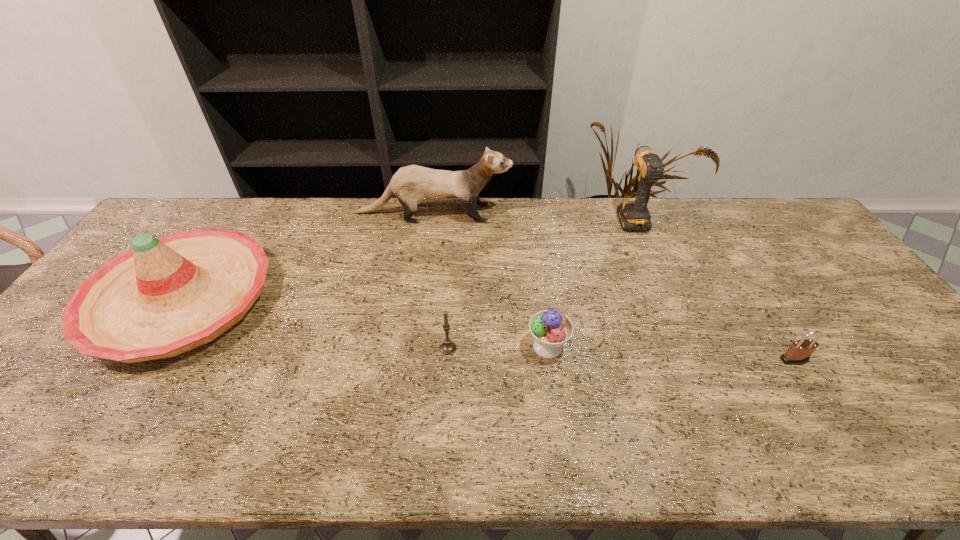
This screenshot has width=960, height=540. Identify the location of drill. (634, 215).

At what (x,y) coordinates should I click in order to perform the action: click on ferret. Please return your answer as a coordinate pair (x, y). The width and height of the screenshot is (960, 540). Looking at the image, I should click on point(412,185).

Where is `the leftmost object`? This screenshot has width=960, height=540. the leftmost object is located at coordinates pos(166,296).

This screenshot has height=540, width=960. Identify the location of candle. (447, 347).

Locate an element on the screen. This screenshot has height=540, width=960. icecream is located at coordinates (551, 329).

Locate an element on the screen. Image resolution: width=960 pixels, height=540 pixels. the rightmost object is located at coordinates (799, 352).

This screenshot has height=540, width=960. In order to click on the shortest object in this screenshot , I will do `click(799, 352)`.

Where is `vacant space located 0.170m on the face of the ferret`? Image resolution: width=960 pixels, height=540 pixels. vacant space located 0.170m on the face of the ferret is located at coordinates (560, 213).

Locate an element on the screen. Image resolution: width=960 pixels, height=540 pixels. blank area located 0.260m on the back of the leftmost object is located at coordinates (250, 197).

Find the location of a particular element. This screenshot has height=540, width=960. vacant space located 0.210m on the left of the candle is located at coordinates (357, 348).